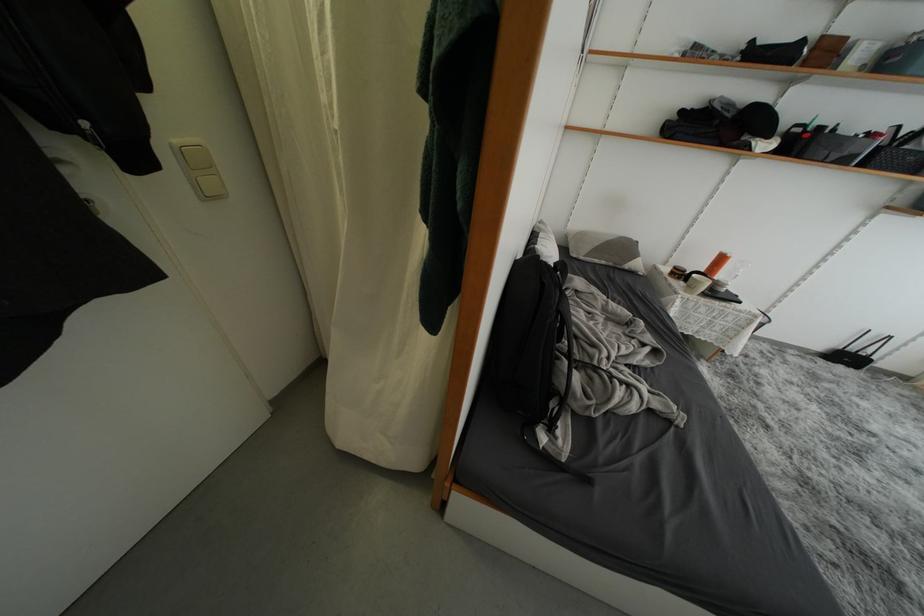
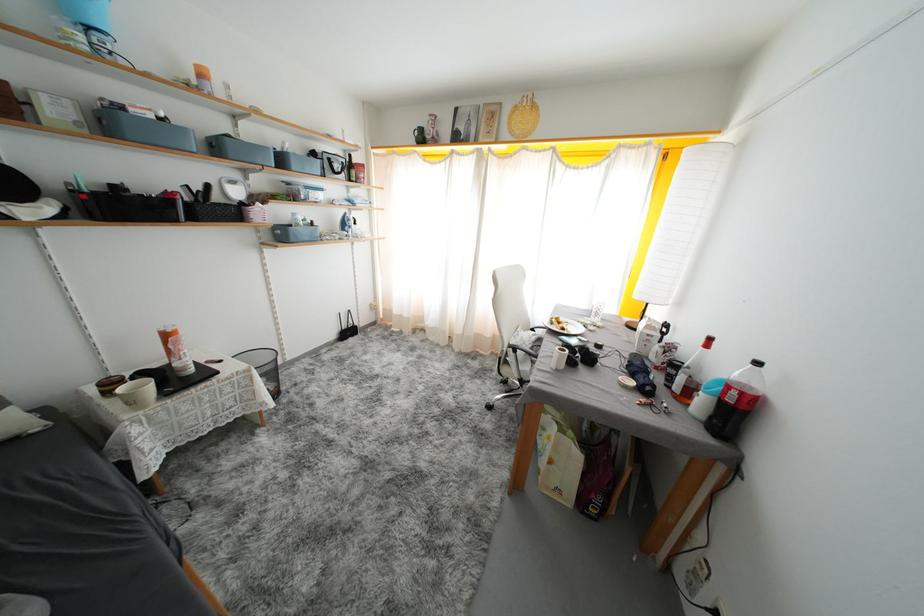
The images are taken continuously from a first-person perspective. In which direction is your viewpoint rotating?

The rotation direction of the camera is right-down.